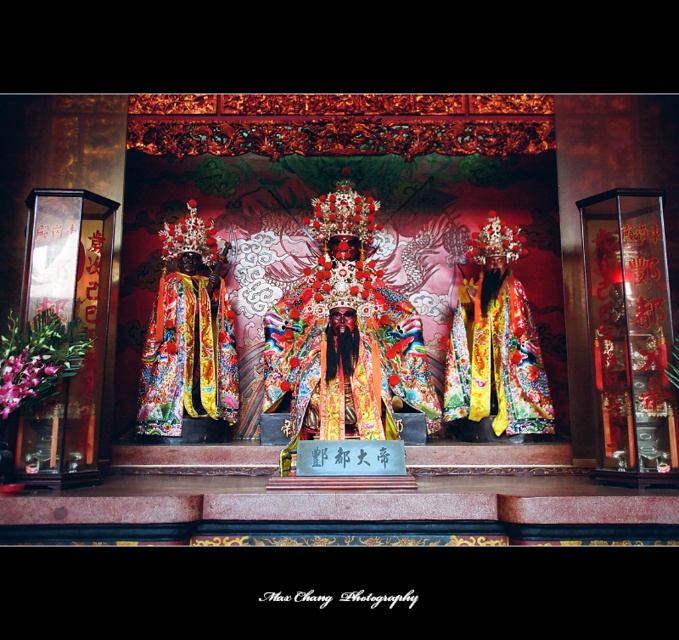
Question: Can you confirm if floral silk robe at center is positioned below pink silk flower at lower left?

Choices:
 (A) yes
 (B) no

Answer: (B)

Question: Based on their relative distances, which object is nearer to the matte gold costume at center?

Choices:
 (A) silky brocade robe at center
 (B) floral silk robe at center
 (C) matte gold crown at center
 (D) pink silk flower at lower left

Answer: (B)

Question: Can you confirm if matte gold costume at center is wider than shiny red flower at center?

Choices:
 (A) no
 (B) yes

Answer: (B)

Question: Which point appears farthest from the camera in this image?

Choices:
 (A) (492, 221)
 (B) (24, 364)

Answer: (A)

Question: Which point appears closest to the camera in this image?

Choices:
 (A) (475, 237)
 (B) (329, 307)
 (C) (26, 355)
 (D) (466, 358)

Answer: (C)

Question: Does floral silk robe at center appear over pink silk flower at lower left?

Choices:
 (A) yes
 (B) no

Answer: (A)